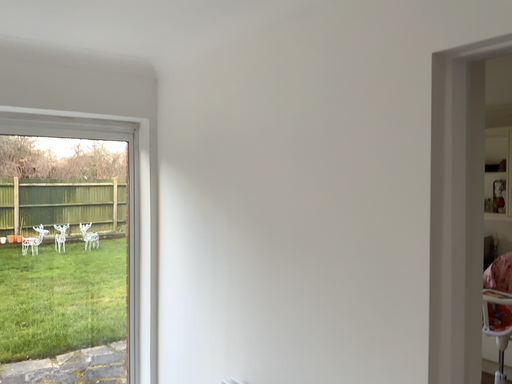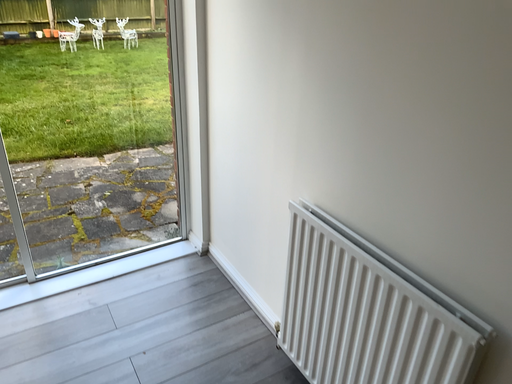
Question: Which way did the camera rotate in the video?

Choices:
 (A) rotated downward
 (B) rotated upward

Answer: (A)